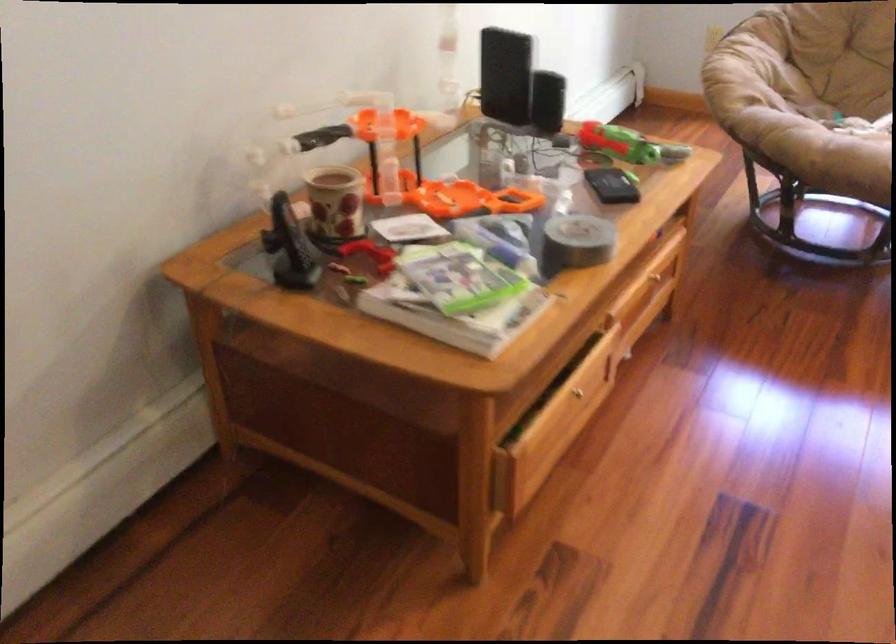
The image size is (896, 644). What do you see at coordinates (745, 69) in the screenshot?
I see `a chair armrest` at bounding box center [745, 69].